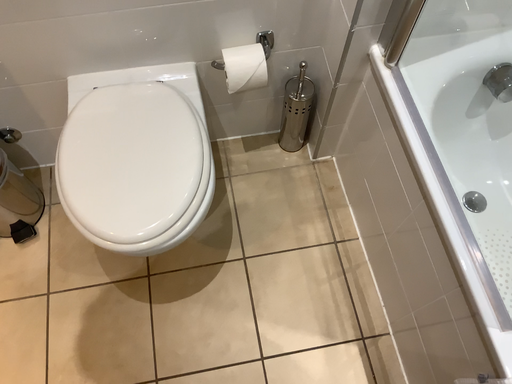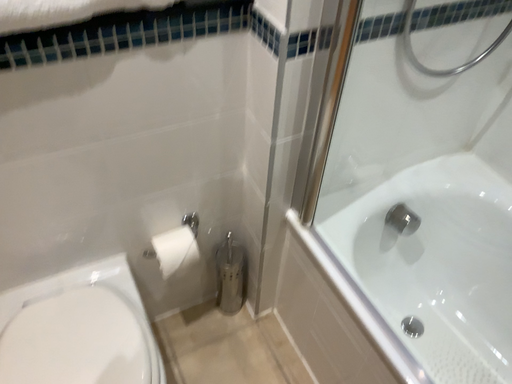
Question: Which way did the camera rotate in the video?

Choices:
 (A) rotated right
 (B) rotated left

Answer: (A)